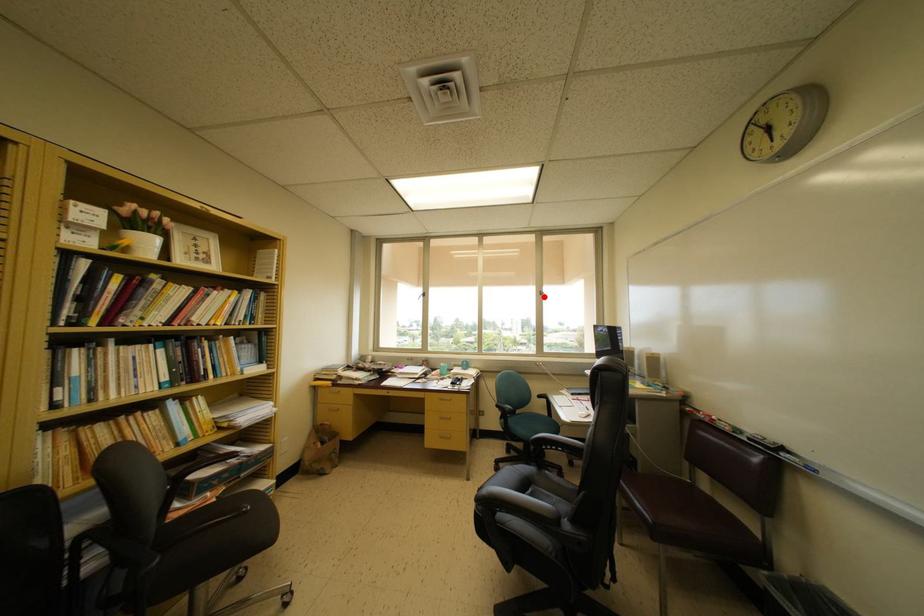
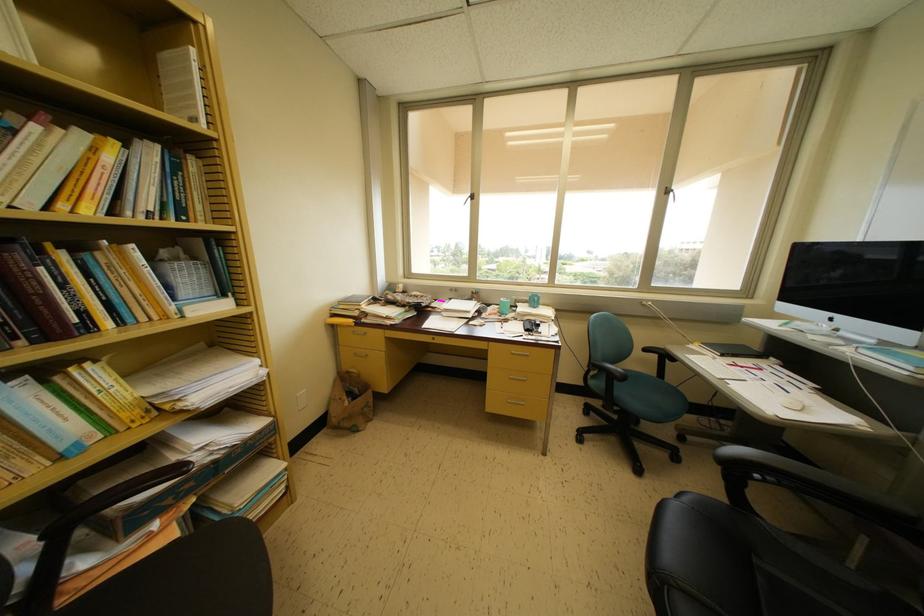
Find the pixel in the second image that matches the highlighted location in the first image.

(671, 193)